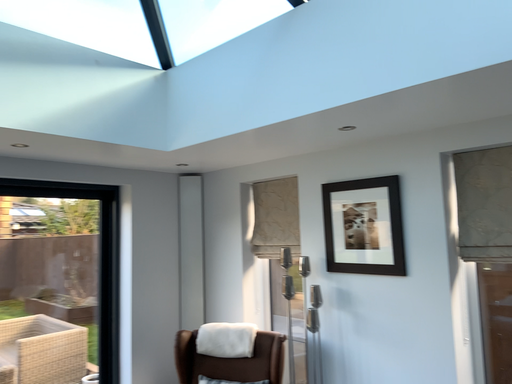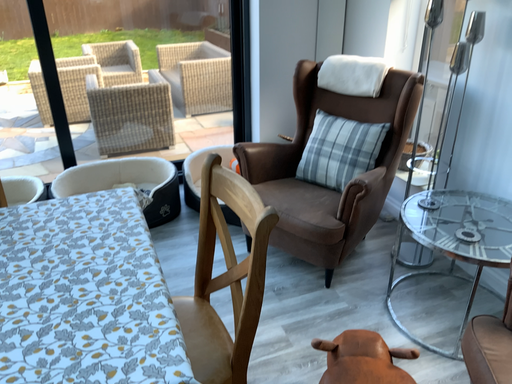
Question: How did the camera likely rotate when shooting the video?

Choices:
 (A) rotated downward
 (B) rotated upward

Answer: (A)